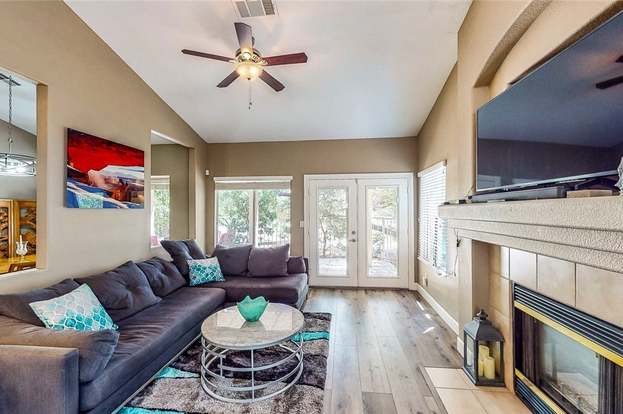
Where is `walls`? walls is located at coordinates (443, 141), (331, 157), (124, 235).